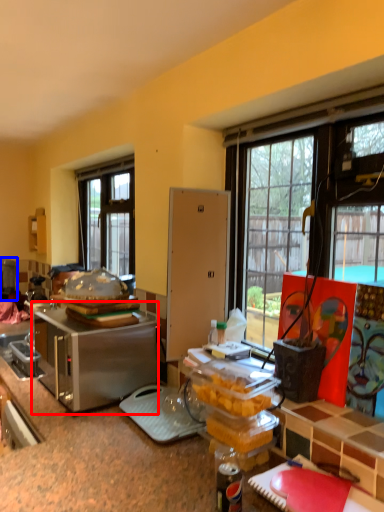
Question: Which object appears farthest to the camera in this image, appliance (highlighted by a red box) or appliance (highlighted by a blue box)?

Choices:
 (A) appliance
 (B) appliance

Answer: (B)